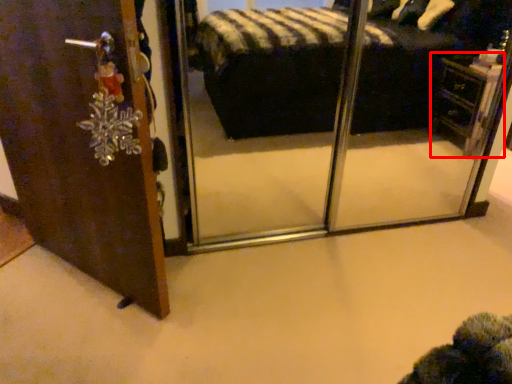
Question: From the image's perspective, what is the correct spatial relationship of vanity (annotated by the red box) in relation to door?

Choices:
 (A) below
 (B) above

Answer: (B)